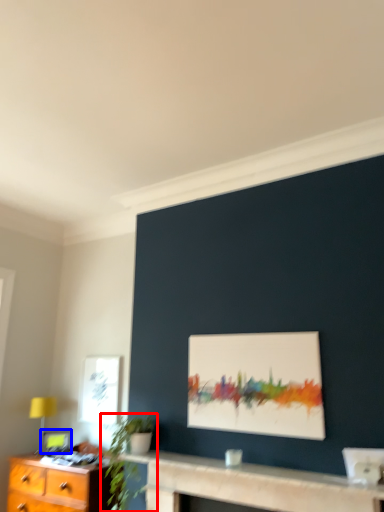
Question: Which point is closer to the camera, houseplant (highlighted by a red box) or picture frame (highlighted by a blue box)?

Choices:
 (A) houseplant
 (B) picture frame

Answer: (A)